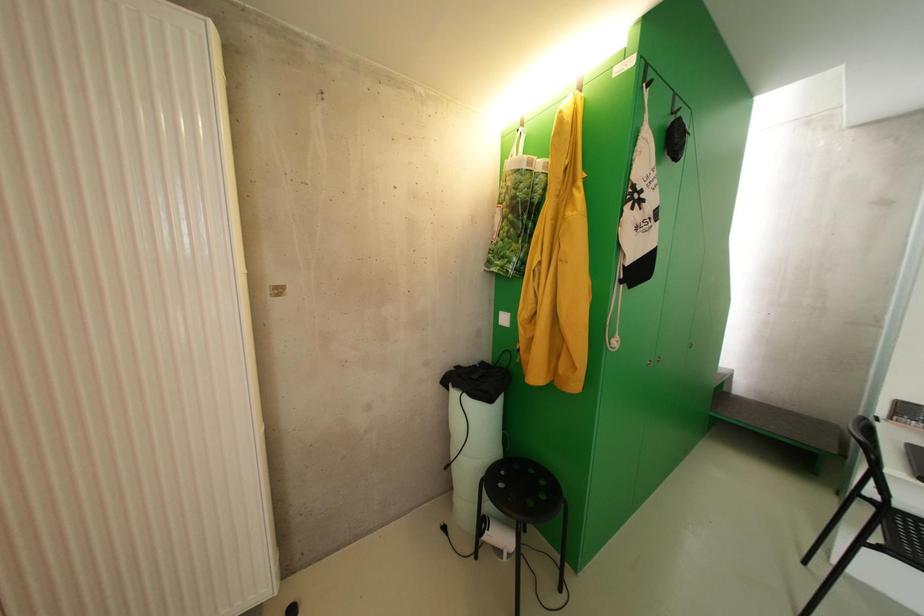
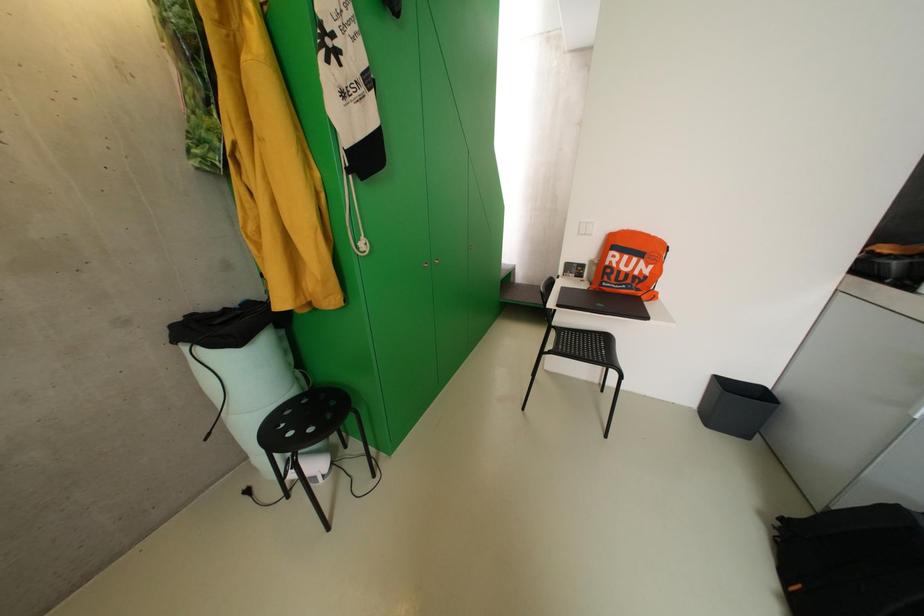
The images are taken continuously from a first-person perspective. In which direction is your viewpoint rotating?

The camera rotated toward right-down.